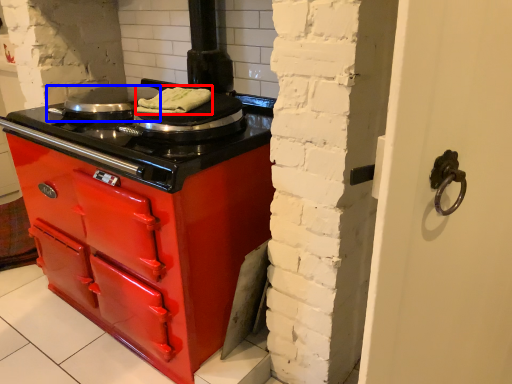
Question: Which object appears closest to the camera in this image, food (highlighted by a red box) or kitchen appliance (highlighted by a blue box)?

Choices:
 (A) food
 (B) kitchen appliance

Answer: (A)